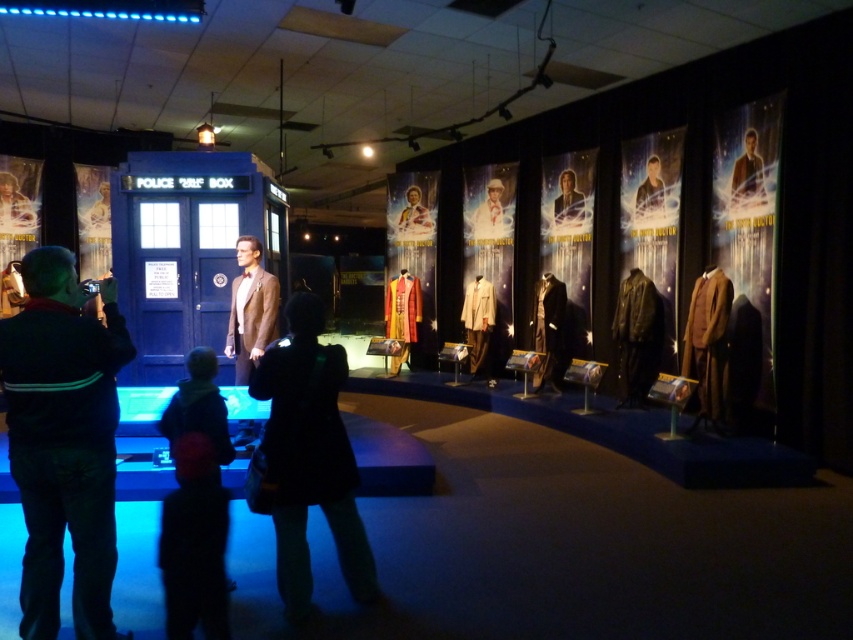
Question: Is dark blue sweater at left thinner than leather jacket at center?

Choices:
 (A) no
 (B) yes

Answer: (A)

Question: Estimate the real-world distances between objects in this image. Which object is closer to the brown wool suit at center?

Choices:
 (A) brown leather jacket at upper center
 (B) dark blue sweater at left

Answer: (B)

Question: Is dark brown leather jacket at center wider than velvet orange coat at center?

Choices:
 (A) no
 (B) yes

Answer: (A)

Question: Among these objects, which one is nearest to the camera?

Choices:
 (A) dark blue sweater at left
 (B) brown wool suit at right

Answer: (A)

Question: Is brown wool suit at right above brown leather jacket at upper center?

Choices:
 (A) no
 (B) yes

Answer: (A)

Question: Which object is farther from the camera taking this photo?

Choices:
 (A) brown wool suit at right
 (B) velvet orange coat at center
 (C) smooth brown leather jacket at center

Answer: (B)